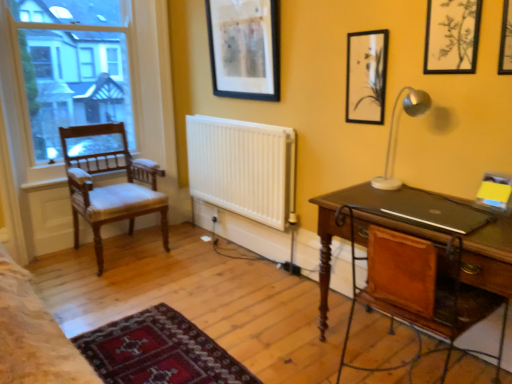
The height and width of the screenshot is (384, 512). What are the coordinates of `free region under white matte radiator at center (from a real-world perspective)` in the screenshot? It's located at (239, 244).